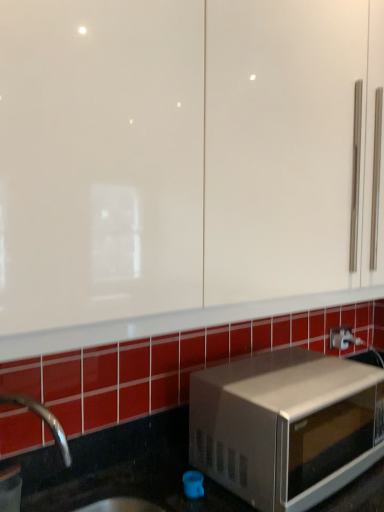
Where is `free location above satin silver microwave at lower right (from a real-world perspective)`? This screenshot has width=384, height=512. free location above satin silver microwave at lower right (from a real-world perspective) is located at coordinates (286, 366).